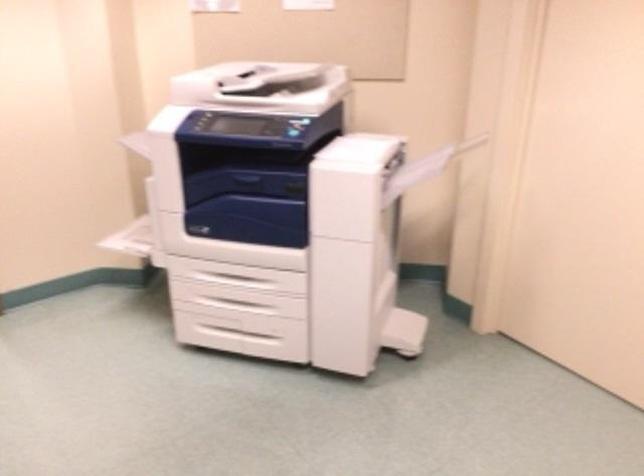
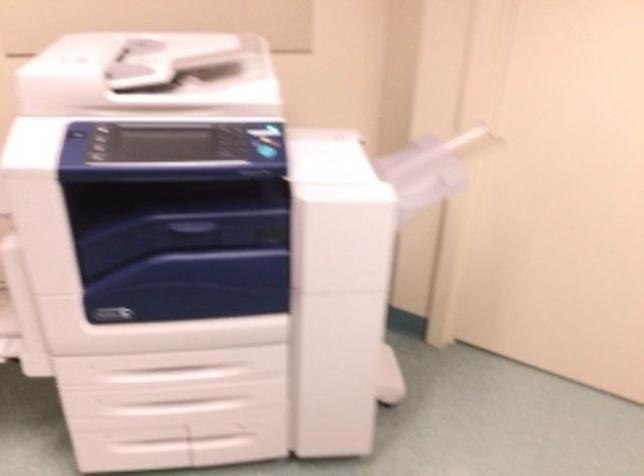
Question: How did the camera likely rotate?

Choices:
 (A) Left
 (B) Right
 (C) Up
 (D) Down

Answer: (B)